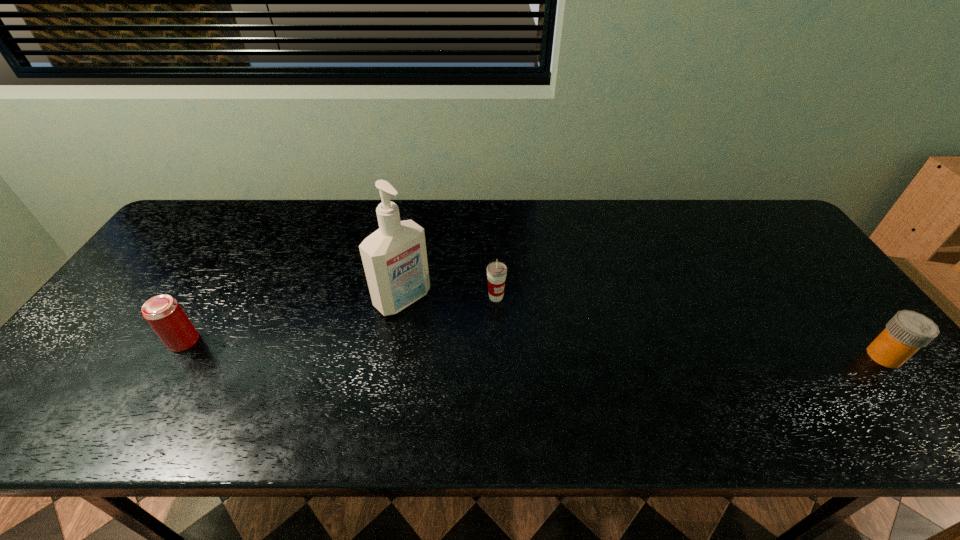
Locate an element on the screen. The image size is (960, 540). vacant region located 0.080m on the front label of the second object from left to right is located at coordinates (439, 331).

You are a GUI agent. You are given a task and a screenshot of the screen. Output one action in this format:
    pyautogui.click(x=<x>, y=<y>)
    Task: Click on the free location located 0.100m on the front label of the second object from left to right
    
    Given the screenshot: What is the action you would take?
    444,335

Where is `object that is at the near edge`? This screenshot has width=960, height=540. object that is at the near edge is located at coordinates (907, 331).

This screenshot has height=540, width=960. Find the location of `object that is at the right edge`. object that is at the right edge is located at coordinates (907, 331).

You are a GUI agent. You are given a task and a screenshot of the screen. Output one action in this format:
    pyautogui.click(x=<x>, y=<y>)
    Task: Click on the object that is positioned at the near right corner
    
    Given the screenshot: What is the action you would take?
    pyautogui.click(x=907, y=331)

In order to click on vacant position at the far edge of the desktop in this screenshot , I will do `click(643, 228)`.

Find the location of a particular element. Image resolution: width=960 pixels, height=540 pixels. free region at the near edge of the desktop is located at coordinates (776, 394).

This screenshot has width=960, height=540. What are the coordinates of `vacant space at the left edge of the desktop` in the screenshot? It's located at (122, 305).

This screenshot has width=960, height=540. Find the location of `vacant space at the right edge`. vacant space at the right edge is located at coordinates (809, 289).

Find the location of a particular element. vacant area that lies between the cup and the medicine is located at coordinates (690, 327).